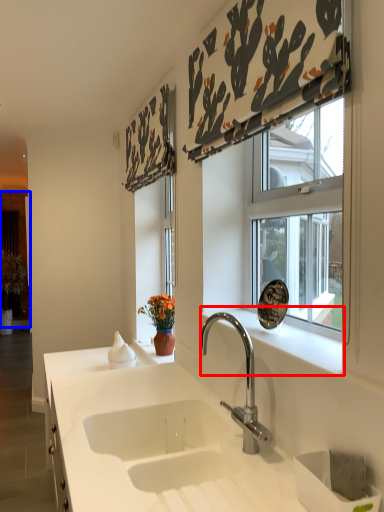
Question: Which of the following is the closest to the observer, window sill (highlighted by a red box) or screen door (highlighted by a blue box)?

Choices:
 (A) window sill
 (B) screen door

Answer: (A)